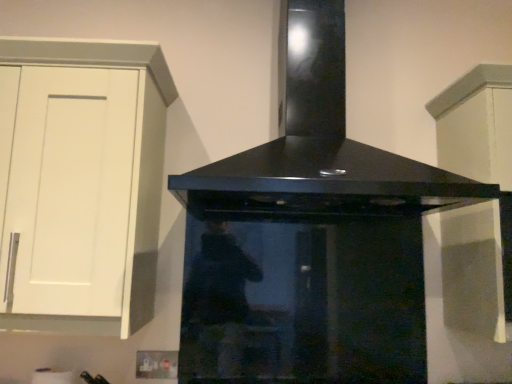
Question: From the image's perspective, is black glossy range hood at center above or below white matte cabinet at left, arranged as the first cabinetry when viewed from the left?

Choices:
 (A) above
 (B) below

Answer: (A)

Question: Is black glossy range hood at center in front of or behind white matte cabinet at left, placed as the second cabinetry when sorted from right to left, in the image?

Choices:
 (A) front
 (B) behind

Answer: (A)

Question: Based on their relative distances, which object is nearer to the black glossy range hood at center?

Choices:
 (A) white matte cabinet at upper right, which is counted as the second cabinetry, starting from the left
 (B) white matte cabinet at left, arranged as the first cabinetry when viewed from the left

Answer: (A)

Question: Which object is positioned farthest from the black glossy range hood at center?

Choices:
 (A) white matte cabinet at left, placed as the second cabinetry when sorted from right to left
 (B) white matte cabinet at upper right, which is counted as the second cabinetry, starting from the left

Answer: (A)